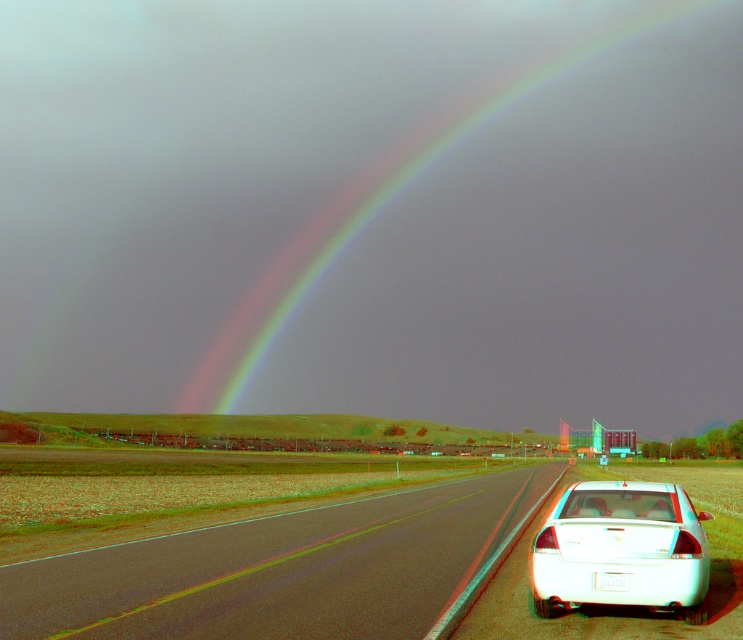
Question: Can you confirm if asphalt road at lower right is positioned to the right of white plastic license plate at lower right?

Choices:
 (A) no
 (B) yes

Answer: (A)

Question: Can you confirm if asphalt road at lower right is wider than white glossy sedan at lower right?

Choices:
 (A) yes
 (B) no

Answer: (A)

Question: Which object is closer to the camera taking this photo?

Choices:
 (A) white plastic license plate at lower right
 (B) asphalt road at lower right

Answer: (B)

Question: Can you confirm if asphalt road at lower right is positioned below white glossy sedan at lower right?

Choices:
 (A) no
 (B) yes

Answer: (B)

Question: Which object is positioned farthest from the white plastic license plate at lower right?

Choices:
 (A) rainbow at upper center
 (B) asphalt road at lower right
 (C) white glossy sedan at lower right

Answer: (A)

Question: Which point is closer to the camera?

Choices:
 (A) rainbow at upper center
 (B) white glossy sedan at lower right
 (C) white plastic license plate at lower right

Answer: (B)